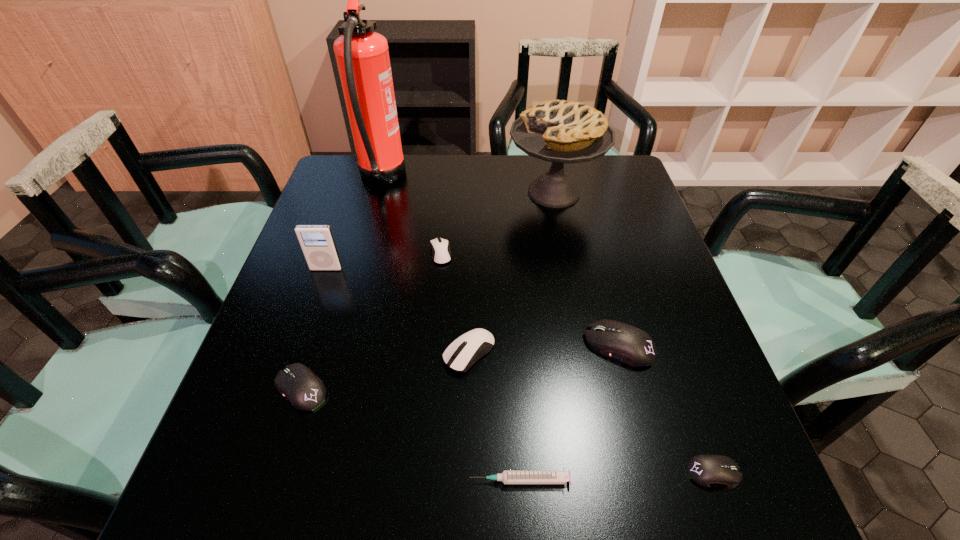
You are a GUI agent. You are given a task and a screenshot of the screen. Output one action in this format:
    pyautogui.click(x=<x>, y=<y>)
    Task: Click on the vacant area in the image that satisfies the following two spatial constraints: 1. at the nozzle of the biggest black computer equipment; 2. on the right side of the fire extinguisher
    The image size is (960, 540).
    Given the screenshot: What is the action you would take?
    pyautogui.click(x=336, y=346)

Identify the location of free space that satisfies the following two spatial constraints: 1. on the back side of the nearer white mouse; 2. at the nozzle of the red fire extinguisher. This screenshot has height=540, width=960. (472, 178).

Locate an element on the screen. This screenshot has width=960, height=540. vacant space that satisfies the following two spatial constraints: 1. on the back side of the bigger white mouse; 2. at the nozzle of the fire extinguisher is located at coordinates (472, 178).

This screenshot has width=960, height=540. I want to click on free space that satisfies the following two spatial constraints: 1. on the cut side of the second tallest object; 2. on the back side of the biggest black computer equipment, so click(584, 346).